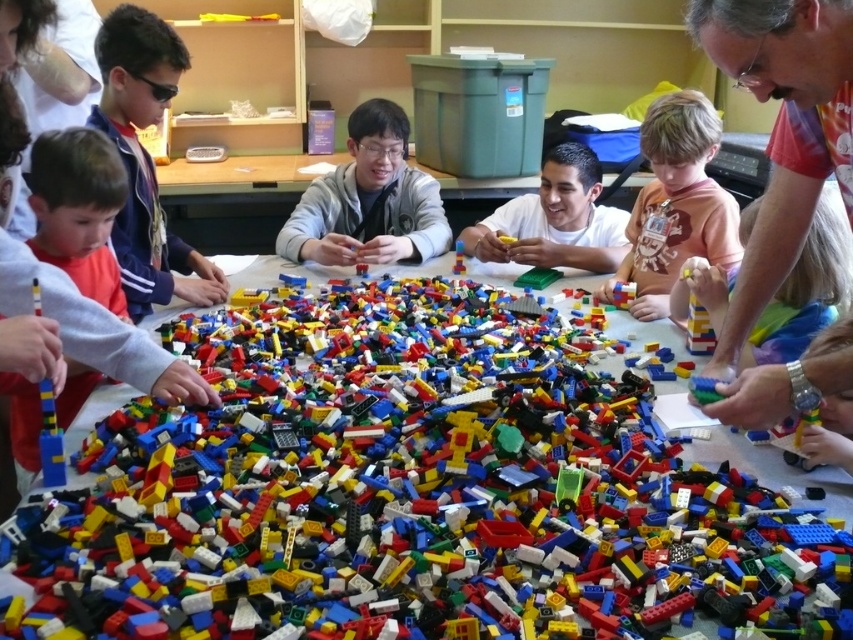
You are a photographer trying to capture a clear shot of the matte red shirt at upper right and the matte plastic boy at center. Since you want both subjects to be in focus, which one should you adjust your camera focus to prioritize based on their heights?

The matte red shirt at upper right is taller than the matte plastic boy at center. To ensure both are in focus, prioritize focusing on the matte red shirt at upper right as it is the taller subject.

You are a child trying to pick up the bright plastic lego bricks at center and the matte red shirt at upper right. Which object is bigger in size?

The bright plastic lego bricks at center are larger in size compared to the matte red shirt at upper right according to the description.

You are a photographer standing in the classroom and want to capture a photo that includes both the matte red shirt at upper right and the matte plastic boy at center. Based on their positions, which object should you ensure is placed lower in the frame to include both?

The matte red shirt at upper right is below the matte plastic boy at center, so to include both in the frame, ensure the matte red shirt at upper right is placed lower since it is already positioned below the matte plastic boy at center.